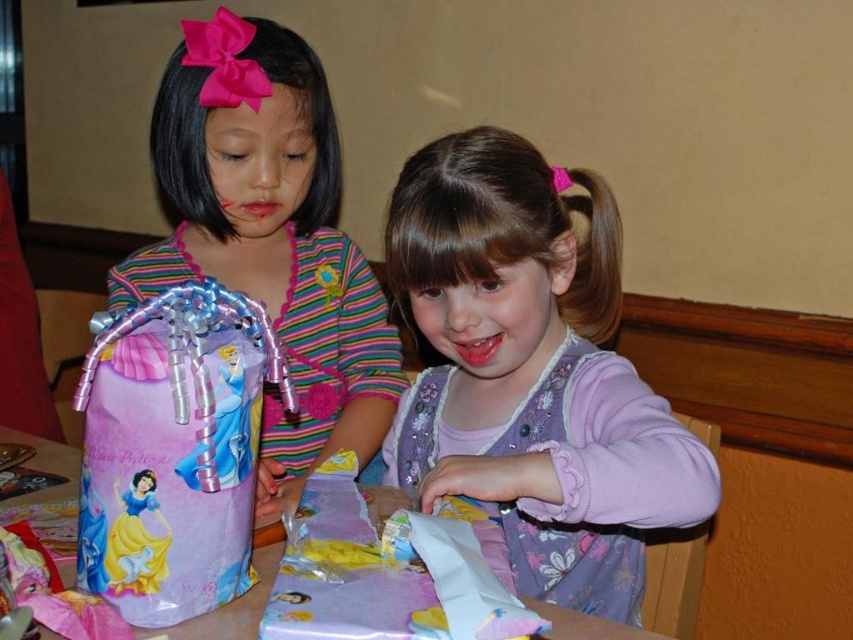
You are a photographer at the event and need to place a small decorative item exactly at the point with coordinates (532, 372). According to the scene description, where should you place the item?

The point with coordinates (532, 372) is on the purple floral dress at center, so you should place the item on the purple floral dress at center.

You are a photographer at a birthday party. You need to take a photo of the purple floral dress at center and the purple paper bag at center. The camera you are using has a minimum focus distance of 10 inches. Will both items be in focus if you place the camera exactly in between them?

The distance between the purple floral dress at center and the purple paper bag at center is 9.88 inches. Since the camera requires a minimum focus distance of 10 inches to focus on both items, the distance is slightly too short. Therefore, the camera might not be able to focus on both items simultaneously if placed exactly in between them.

You are a parent at a child birthday party. You see the matte plastic bag at left and the pink glossy paper at lower center on the table. Which object is taller?

The matte plastic bag at left is taller than pink glossy paper at lower center.